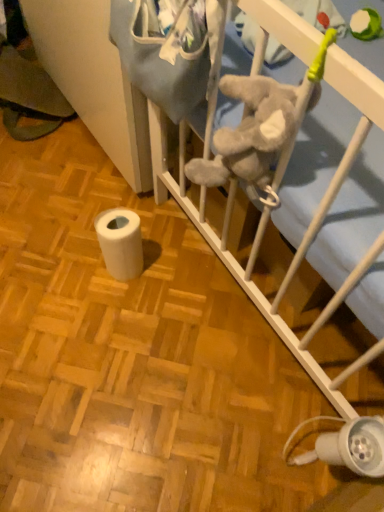
Identify the location of free space to the right of white matte toilet paper at lower left. (180, 279).